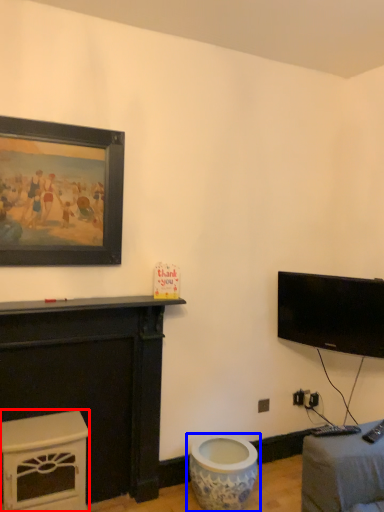
Question: Which object is further to the camera taking this photo, furniture (highlighted by a red box) or toilet (highlighted by a blue box)?

Choices:
 (A) furniture
 (B) toilet

Answer: (B)